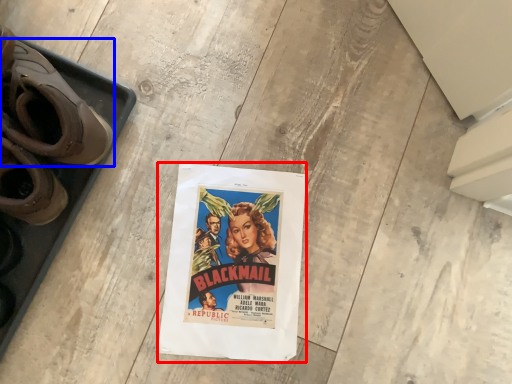
Question: Which point is closer to the camera, poster (highlighted by a red box) or footwear (highlighted by a blue box)?

Choices:
 (A) poster
 (B) footwear

Answer: (B)